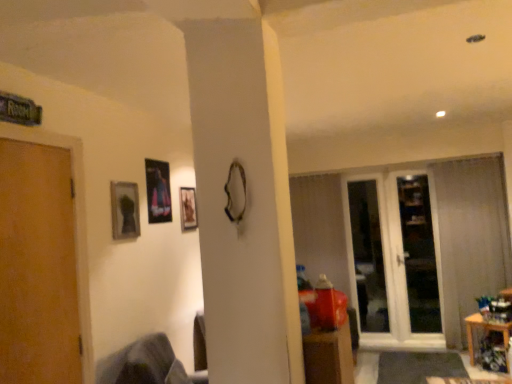
Question: From the image's perspective, is transparent glass door at right on top of dark gray fabric swivel chair at lower left?

Choices:
 (A) yes
 (B) no

Answer: (A)

Question: Considering the relative sizes of transparent glass door at right and dark gray fabric swivel chair at lower left in the image provided, is transparent glass door at right smaller than dark gray fabric swivel chair at lower left?

Choices:
 (A) no
 (B) yes

Answer: (B)

Question: Is transparent glass door at right positioned far away from dark gray fabric swivel chair at lower left?

Choices:
 (A) no
 (B) yes

Answer: (B)

Question: Can you confirm if transparent glass door at right is positioned to the left of dark gray fabric swivel chair at lower left?

Choices:
 (A) no
 (B) yes

Answer: (A)

Question: Considering the relative sizes of transparent glass door at right and dark gray fabric swivel chair at lower left in the image provided, is transparent glass door at right thinner than dark gray fabric swivel chair at lower left?

Choices:
 (A) yes
 (B) no

Answer: (A)

Question: Visually, is wooden picture frame at center, positioned as the first picture frame in right-to-left order, positioned to the left or to the right of transparent glass door at right?

Choices:
 (A) right
 (B) left

Answer: (B)

Question: Is point (189, 190) closer or farther from the camera than point (385, 175)?

Choices:
 (A) closer
 (B) farther

Answer: (A)

Question: Looking at their shapes, would you say wooden picture frame at center, which is the third picture frame from left to right, is wider or thinner than transparent glass door at right?

Choices:
 (A) wide
 (B) thin

Answer: (B)

Question: Would you say wooden picture frame at center, which is the first picture frame in back-to-front order, is inside or outside transparent glass door at right?

Choices:
 (A) inside
 (B) outside

Answer: (B)

Question: Visually, is white plastic screen door at right positioned to the left or to the right of wooden picture frame at center, which is the third picture frame from left to right?

Choices:
 (A) left
 (B) right

Answer: (B)

Question: From their relative heights in the image, would you say white plastic screen door at right is taller or shorter than wooden picture frame at center, which ranks as the third picture frame in front-to-back order?

Choices:
 (A) short
 (B) tall

Answer: (B)

Question: In the image, is white plastic screen door at right positioned in front of or behind wooden picture frame at center, which ranks as the third picture frame in front-to-back order?

Choices:
 (A) front
 (B) behind

Answer: (B)

Question: Considering the positions of point (387, 329) and point (182, 205), is point (387, 329) closer or farther from the camera than point (182, 205)?

Choices:
 (A) closer
 (B) farther

Answer: (B)

Question: Does point (65, 205) appear closer or farther from the camera than point (189, 213)?

Choices:
 (A) closer
 (B) farther

Answer: (A)

Question: From a real-world perspective, relative to wooden picture frame at center, positioned as the first picture frame in right-to-left order, is wooden door at left vertically above or below?

Choices:
 (A) below
 (B) above

Answer: (A)